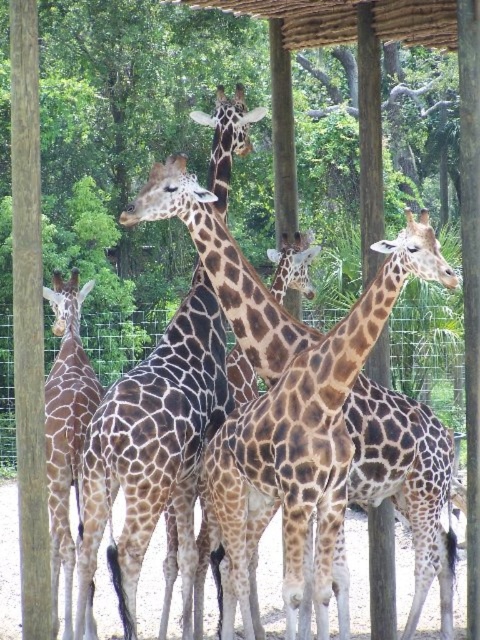
You are a zookeeper standing at the center of the enclosure. You need to locate the brown wood pole at left. Based on the coordinates provided, in which direction should you look to find it?

The brown wood pole at left is located at coordinates point (x=28, y=323). Since you are at the center, looking towards the left side of the enclosure will allow you to find the brown wood pole at left.

You are a zookeeper trying to locate a specific giraffe in the enclosure. You have a map with coordinates. The map shows a point at coordinates [287,401]. Which giraffe does this point correspond to?

The point at coordinates [287,401] corresponds to the brown spotted giraffe at center.